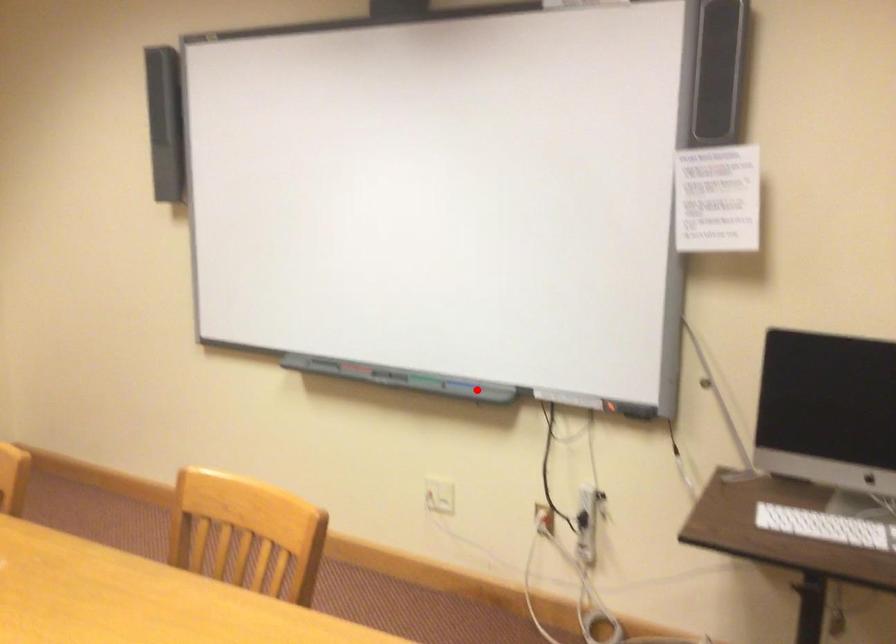
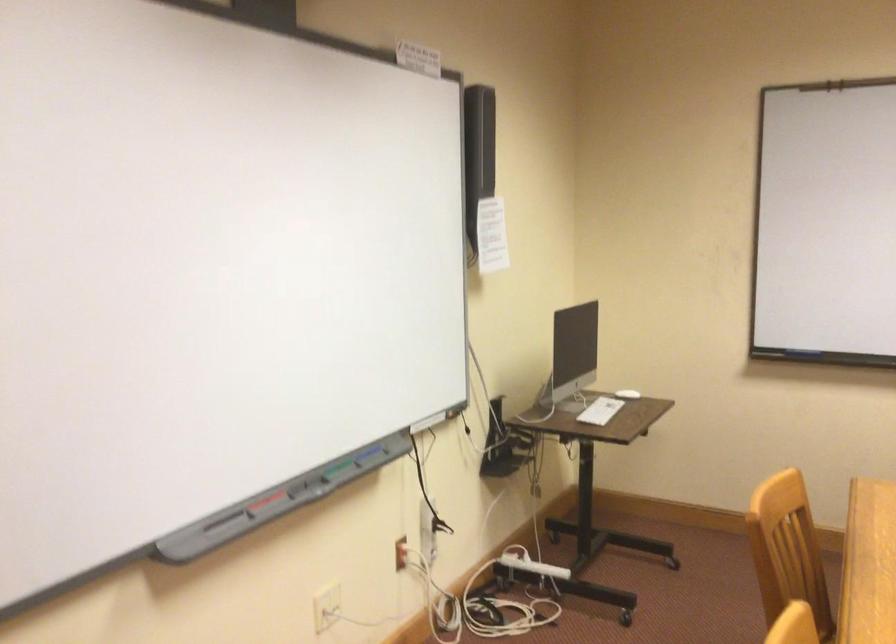
In the second image, find the point that corresponds to the highlighted location in the first image.

(368, 453)